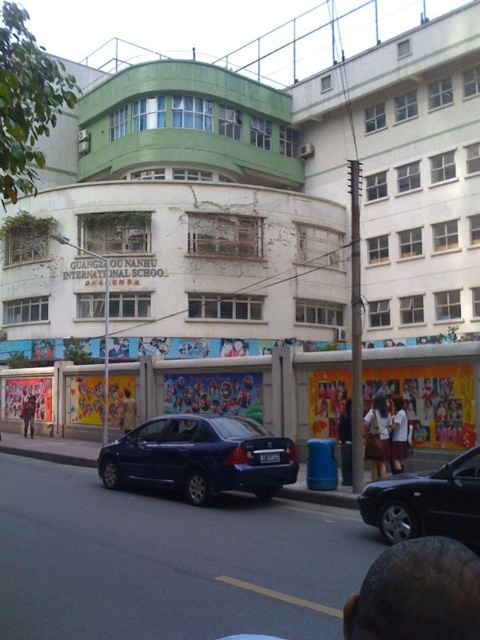
Question: Which of the following is the farthest from the observer?

Choices:
 (A) matte blue sedan at center
 (B) brown leather jacket at center
 (C) white fabric shirt at lower center

Answer: (B)

Question: Which object is closer to the camera taking this photo?

Choices:
 (A) dark blue jeans at center
 (B) brown leather jacket at center
 (C) dark blue metallic sedan at center

Answer: (C)

Question: In this image, where is dark blue jeans at center located relative to brown fabric person at center?

Choices:
 (A) right
 (B) left

Answer: (A)

Question: Does matte blue sedan at center have a lesser width compared to dark blue metallic sedan at center?

Choices:
 (A) yes
 (B) no

Answer: (B)

Question: Can you confirm if dark blue metallic sedan at center is positioned below white fabric shirt at lower center?

Choices:
 (A) yes
 (B) no

Answer: (B)

Question: Which point is farther to the camera?

Choices:
 (A) dark blue metallic sedan at center
 (B) brown fabric person at center

Answer: (B)